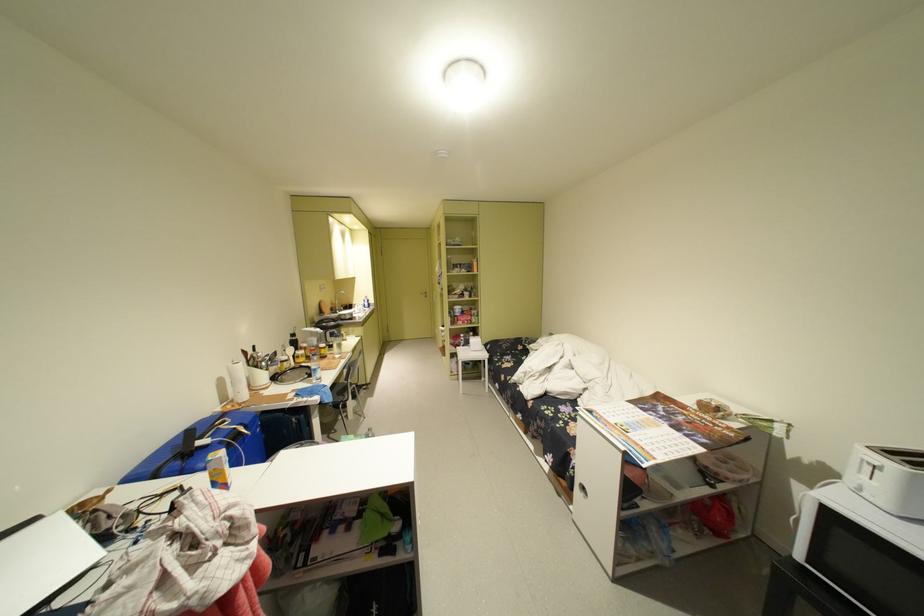
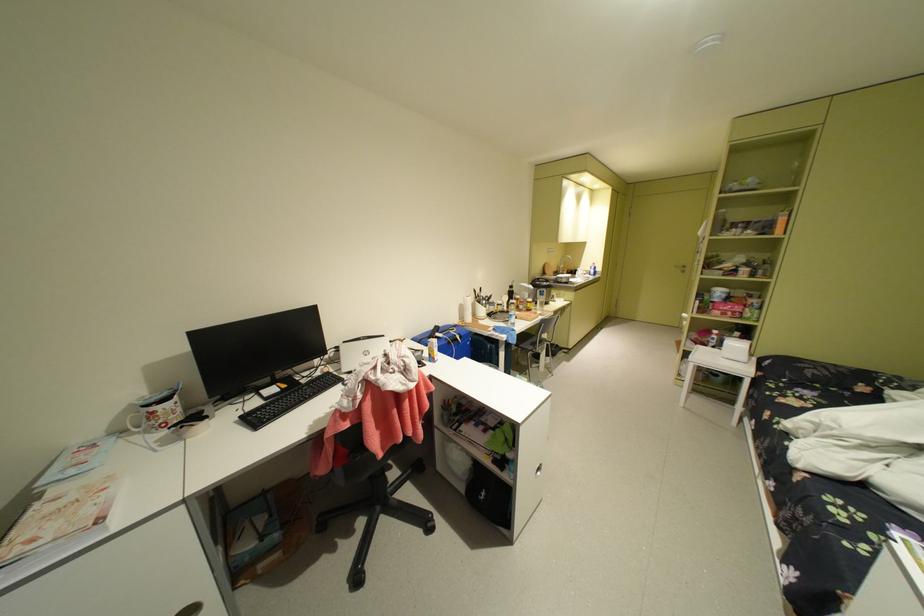
Question: Based on the continuous images, in which direction is the camera rotating? Reply with the corresponding letter.

Choices:
 (A) Left
 (B) Right
 (C) Up
 (D) Down

Answer: (A)